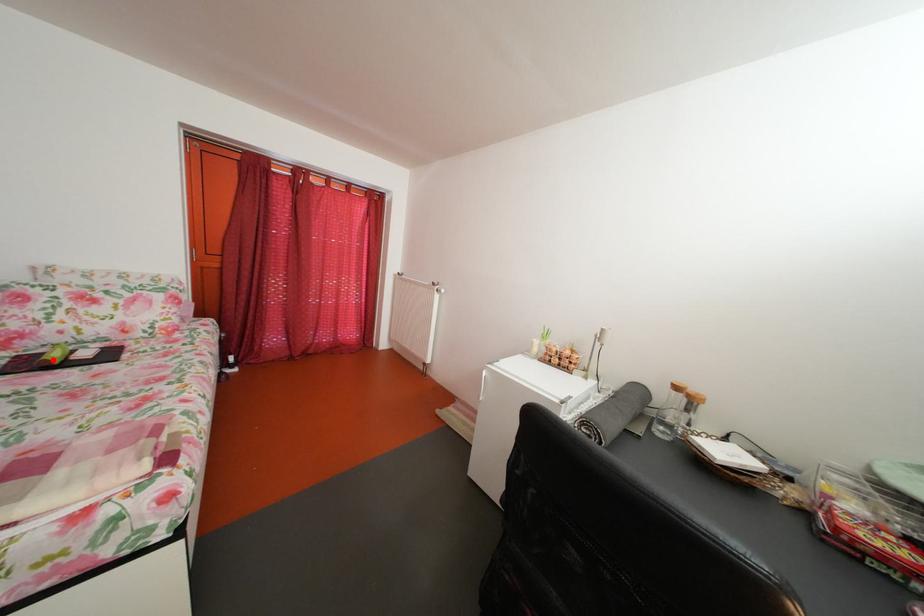
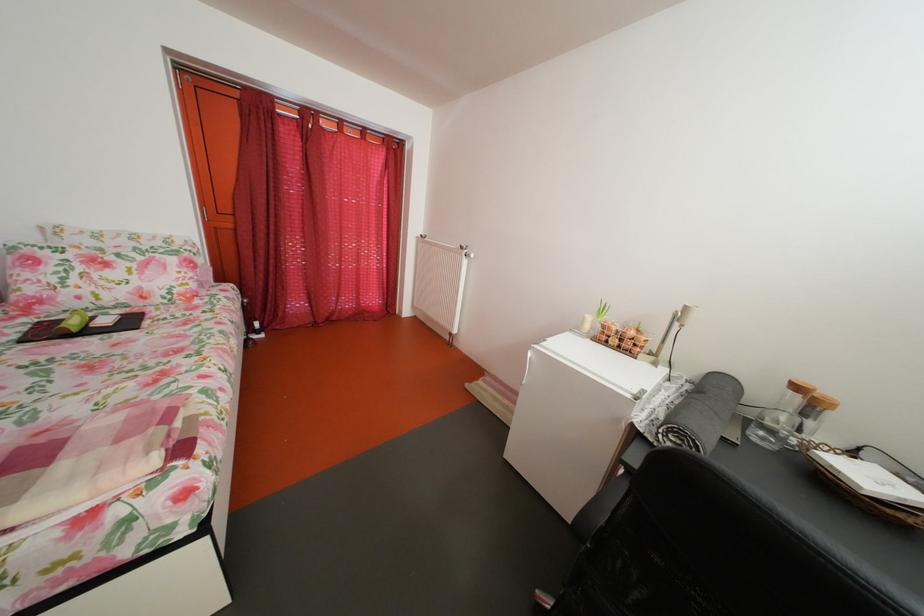
Locate, in the second image, the point that corresponds to the highlighted location in the first image.

(73, 326)